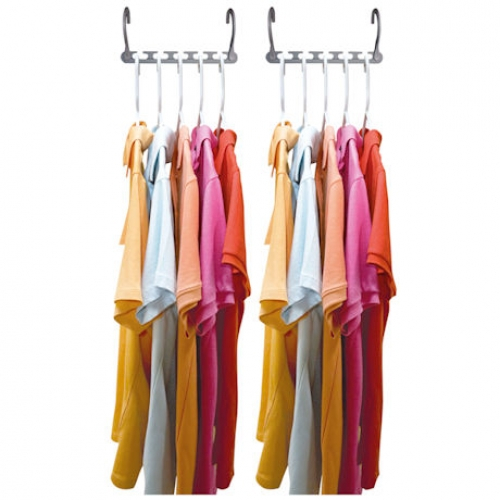
Locate an element on the screen. shirt hangers is located at coordinates (133, 62), (163, 77), (179, 81), (204, 83), (220, 94), (285, 84), (302, 88), (333, 90), (349, 93), (379, 94).